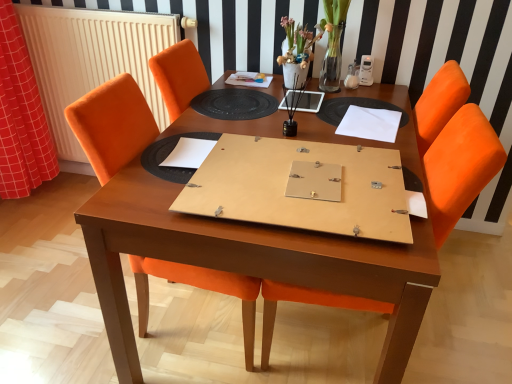
Where is `vacant area to the right of white paper at center, acting as the first notebook starting from the left`? The width and height of the screenshot is (512, 384). vacant area to the right of white paper at center, acting as the first notebook starting from the left is located at coordinates (245, 145).